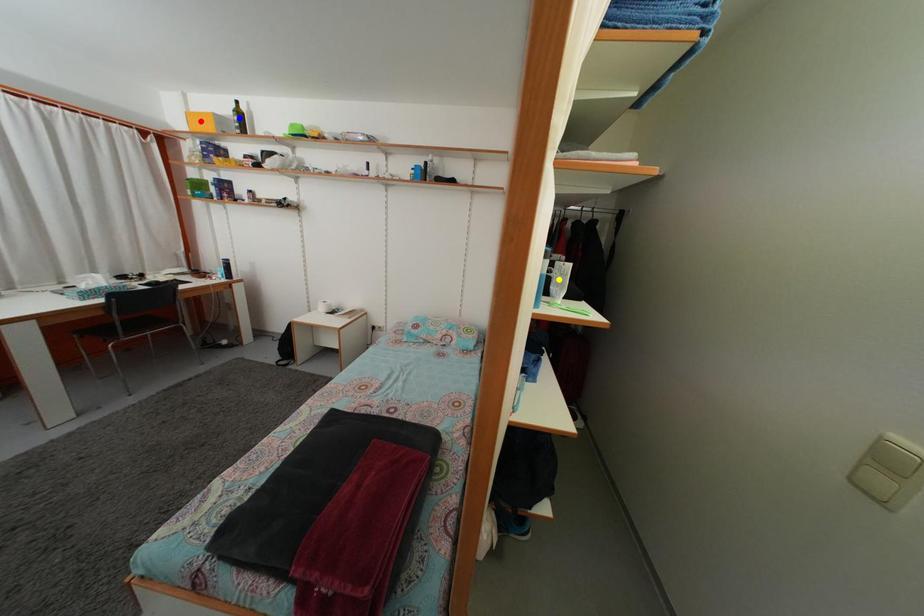
Order these from farthest to nearest:
- red point
- blue point
- yellow point

red point < blue point < yellow point